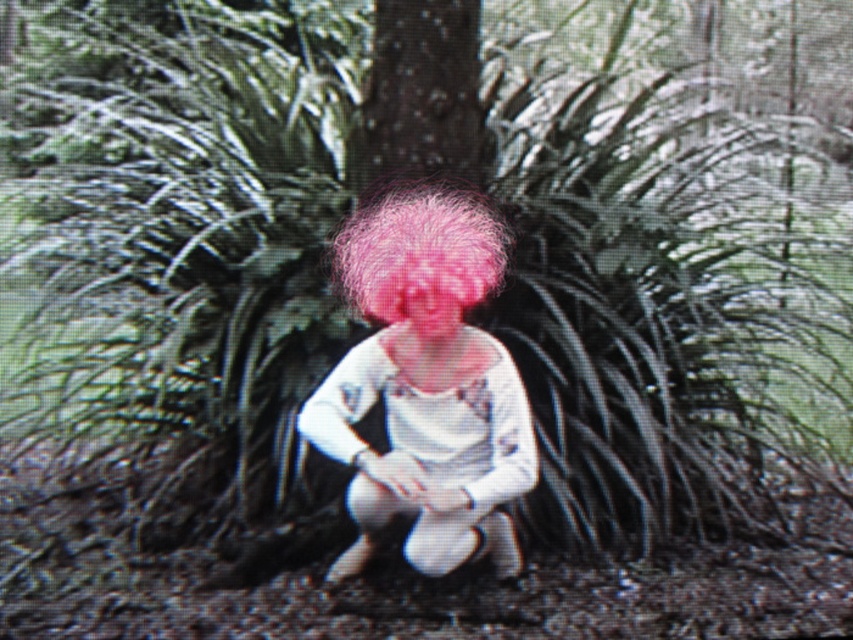
You are a photographer trying to capture the person in the scene. You notice both the fuzzy pink hair at center and the pink fluffy wig at center. Which one should you focus on if you want to highlight something larger in your photo?

The fuzzy pink hair at center is bigger than the pink fluffy wig at center, so focusing on the fuzzy pink hair at center would highlight the larger object in the photo.